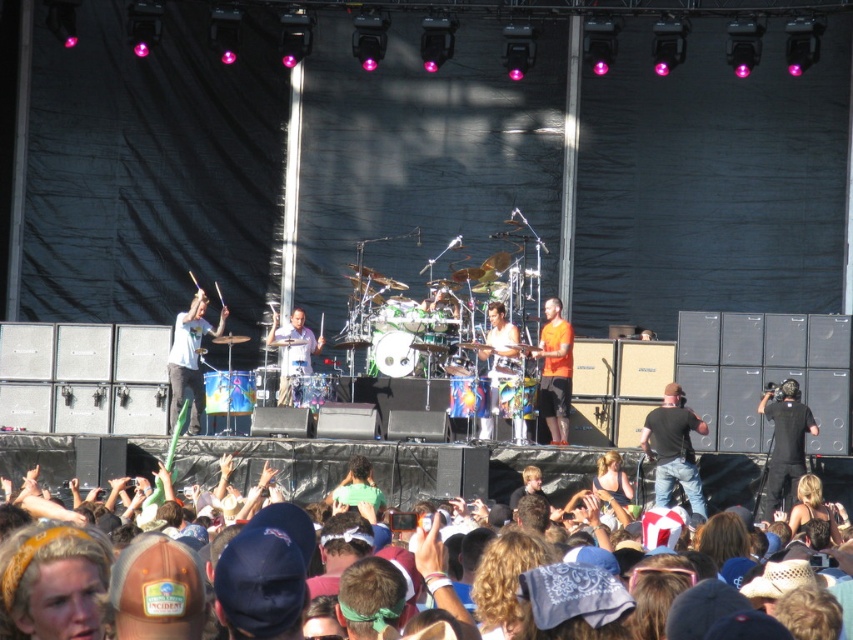
You are a photographer at the concert. You want to capture a photo that includes both the multicolored fabric at lower center and the matte blue drum set at center. Which object should you focus on first to ensure both are in frame?

The multicolored fabric at lower center is larger than the matte blue drum set at center, so focusing on the multicolored fabric at lower center first will help ensure both objects are included in the frame.

You are a photographer standing at the center of the stage. You want to take a photo of both point (225, 308) and point (519, 438). Which point should you focus on first to ensure both are in focus?

You should focus on point (225, 308) first because it is closer to the camera than point (519, 438). By focusing on the closer point, the depth of field may also cover the farther point, ensuring both are in focus.